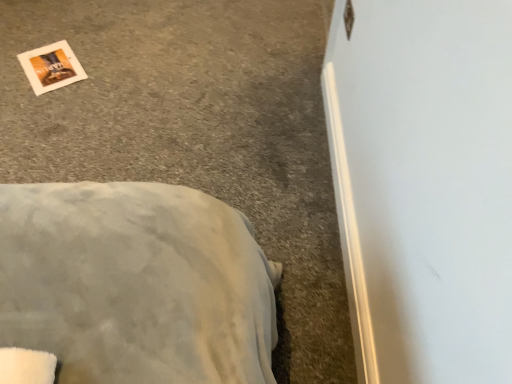
Locate an element on the screen. This screenshot has width=512, height=384. vacant area to the right of white paper at upper left is located at coordinates (101, 65).